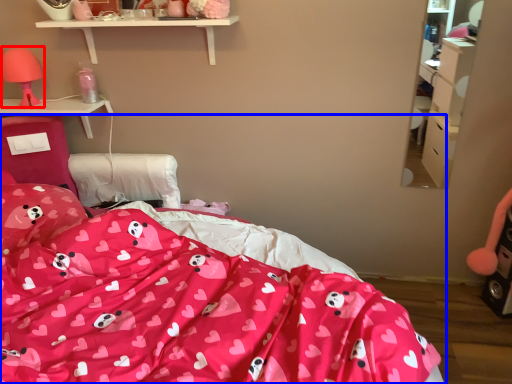
Question: Which point is further to the camera, table lamp (highlighted by a red box) or bed (highlighted by a blue box)?

Choices:
 (A) table lamp
 (B) bed

Answer: (A)